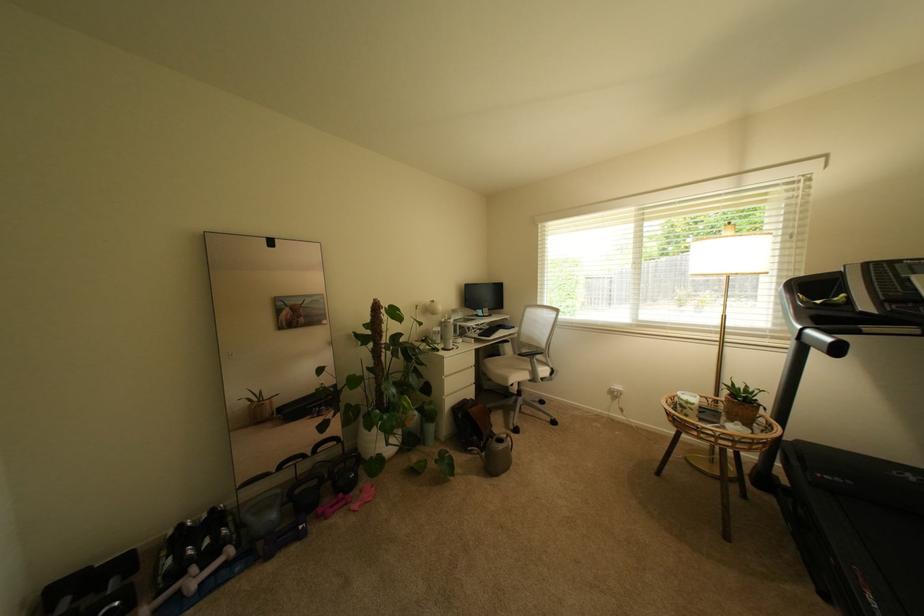
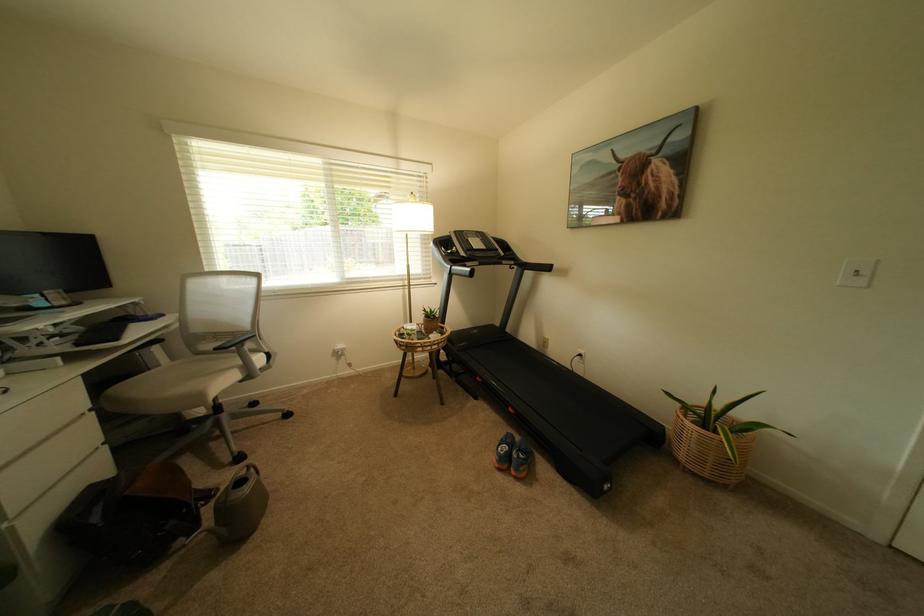
Where in the second image is the point corresponding to [507,357] from the first image?

(157, 370)